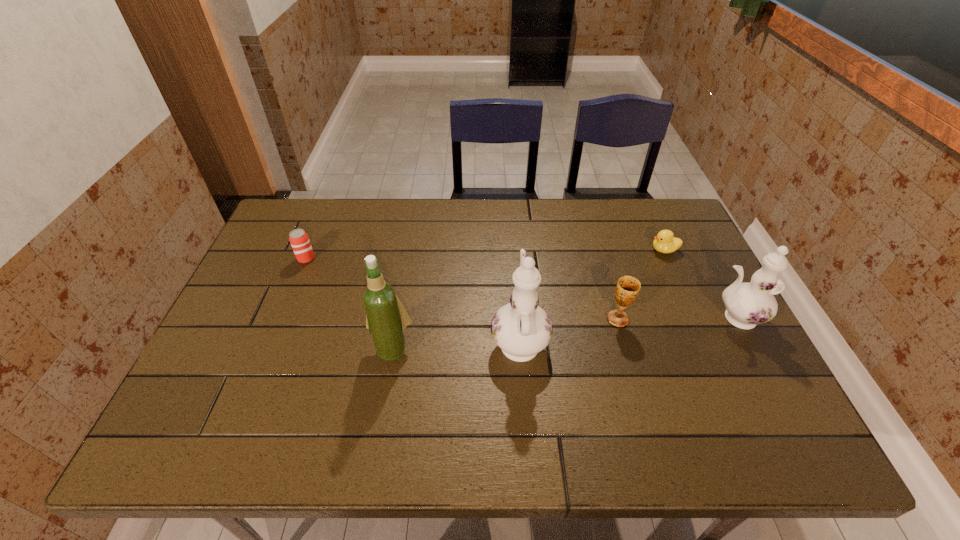
Where is `free location that satisfies the following two spatial constraints: 1. at the spout of the left chinaware; 2. on the left side of the third object from right to left`? Image resolution: width=960 pixels, height=540 pixels. free location that satisfies the following two spatial constraints: 1. at the spout of the left chinaware; 2. on the left side of the third object from right to left is located at coordinates (517, 319).

Locate an element on the screen. The width and height of the screenshot is (960, 540). free space in the image that satisfies the following two spatial constraints: 1. on the beak of the shortest object; 2. on the front side of the leftmost object is located at coordinates (668, 259).

This screenshot has width=960, height=540. What are the coordinates of `vacant point that satisfies the following two spatial constraints: 1. at the spout of the taller chinaware; 2. on the left side of the third object from right to left` in the screenshot? It's located at (517, 319).